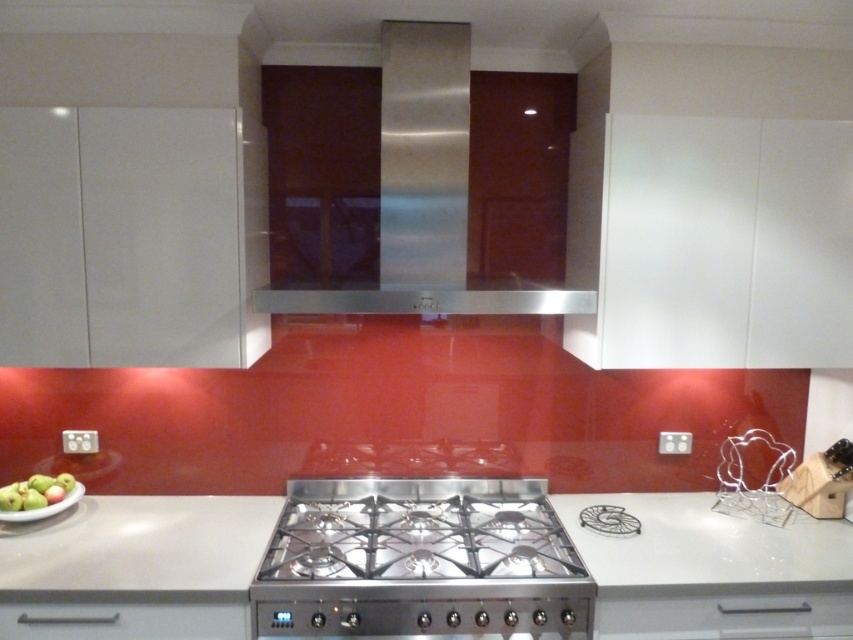
You are preparing to place a large pot on the satin white countertop at center and the stainless steel gas stove at center. Which surface can accommodate the pot more comfortably?

The stainless steel gas stove at center is larger than the satin white countertop at center, so it can accommodate the pot more comfortably.

You are standing in the kitchen and want to place a small bowl on the satin white countertop at center. According to the coordinates provided, where exactly should you place the bowl?

The satin white countertop at center is located at coordinates point (136, 566), so place the bowl there.

You are preparing to place a green matte apple at lower left on the kitchen counter. However, there is a stainless steel exhaust hood at center above it. Will the exhaust hood block the placement of the apple?

The stainless steel exhaust hood at center is above the green matte apple at lower left, so it will not block the placement of the apple since it is positioned higher up and does not occupy the same horizontal space.